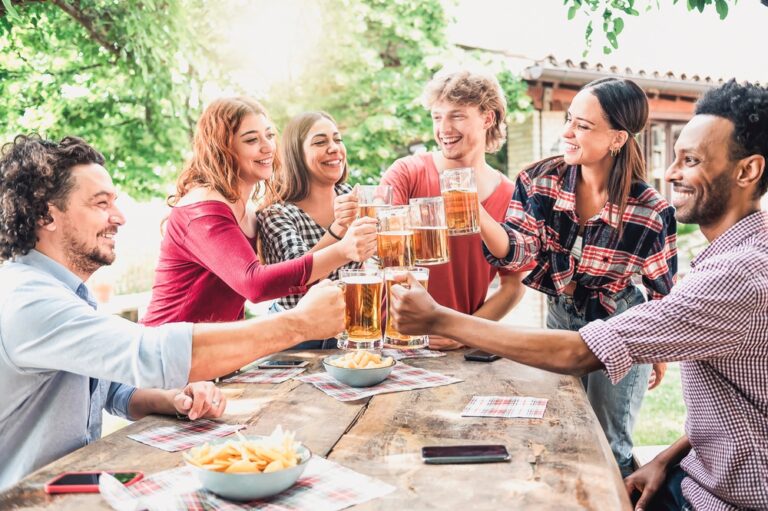
This screenshot has width=768, height=511. Find the location of `napkins`. napkins is located at coordinates (521, 409), (406, 379), (419, 349), (255, 373), (214, 425), (326, 489), (174, 493).